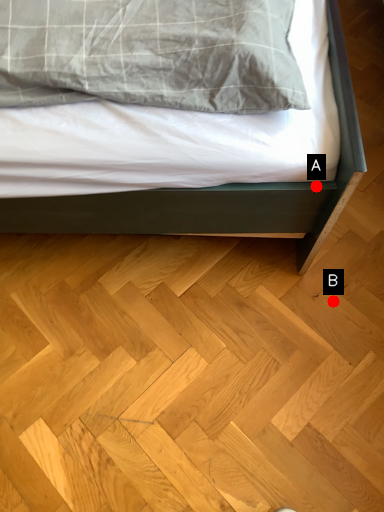
Question: Two points are circled on the image, labeled by A and B beside each circle. Among these points, which one is nearest to the camera?

Choices:
 (A) A is closer
 (B) B is closer

Answer: (A)